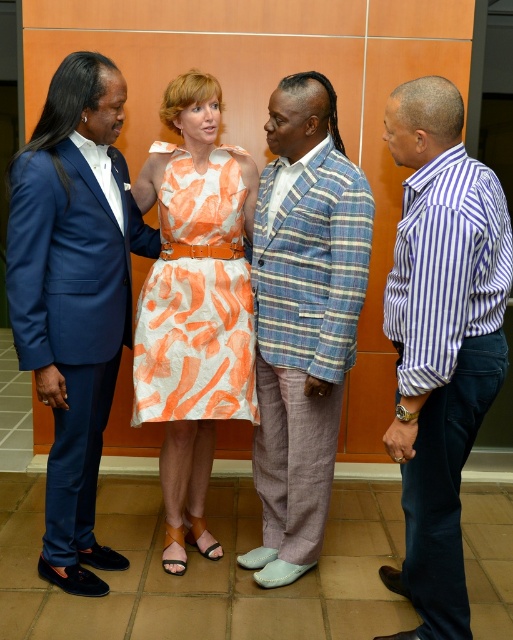
You are standing in front of the group and want to approach the two points marked in the image. Which point, point (418, 116) or point (284, 484), is closer to you?

Point (418, 116) is closer to the viewer than point (284, 484).

Where is the matte blue suit at left located in the image?

The matte blue suit at left is located at point 0.463 on the x axis and 0.146 on the y axis.